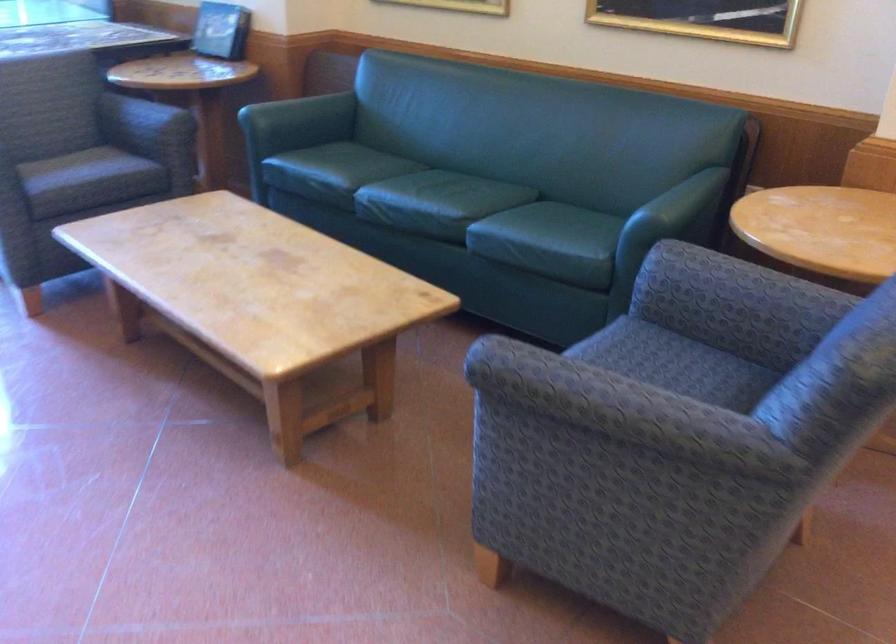
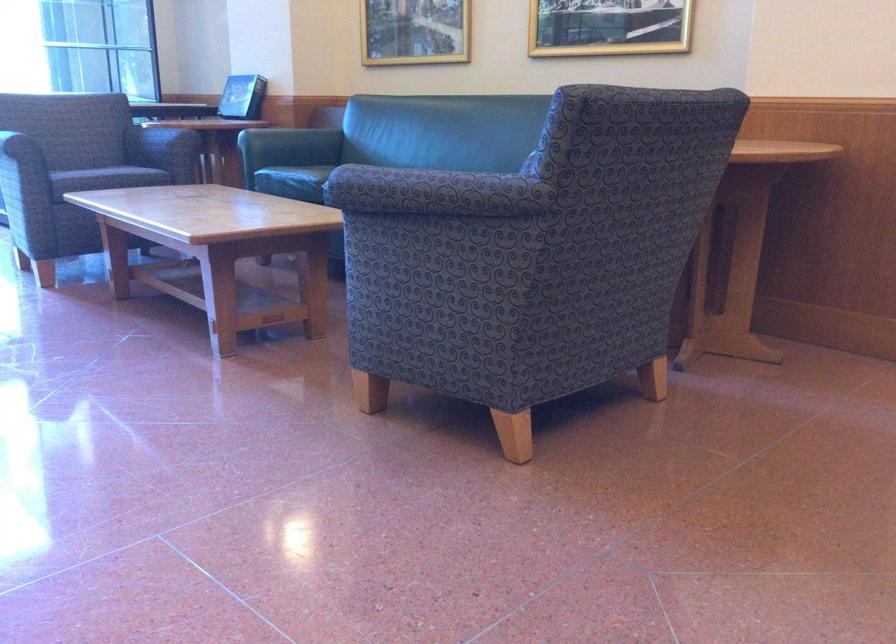
Locate, in the second image, the point that corresponds to [319,183] in the first image.

(293, 182)